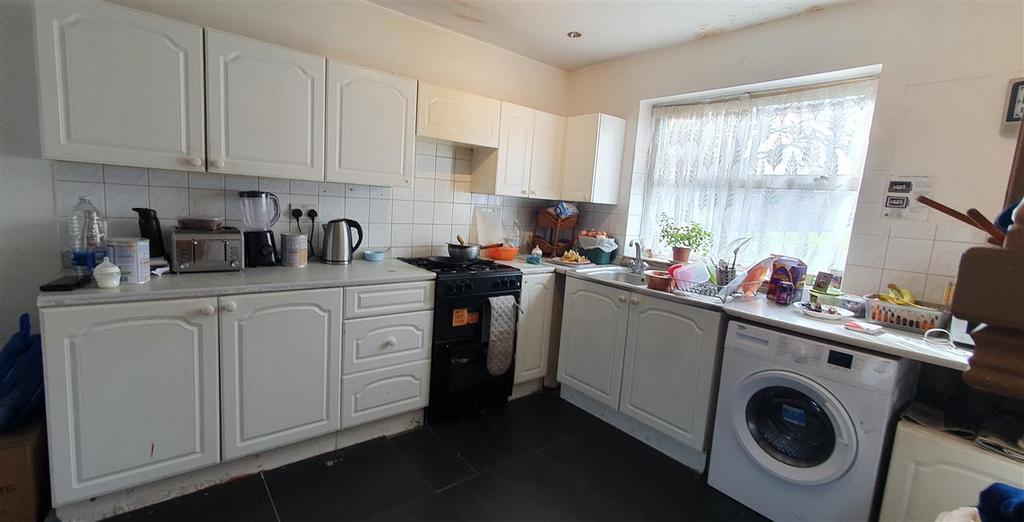
Image resolution: width=1024 pixels, height=522 pixels. What are the coordinates of `cabine doors` in the screenshot? It's located at 592,341, 656,365, 296,345, 160,358, 138,109, 261,113, 394,152.